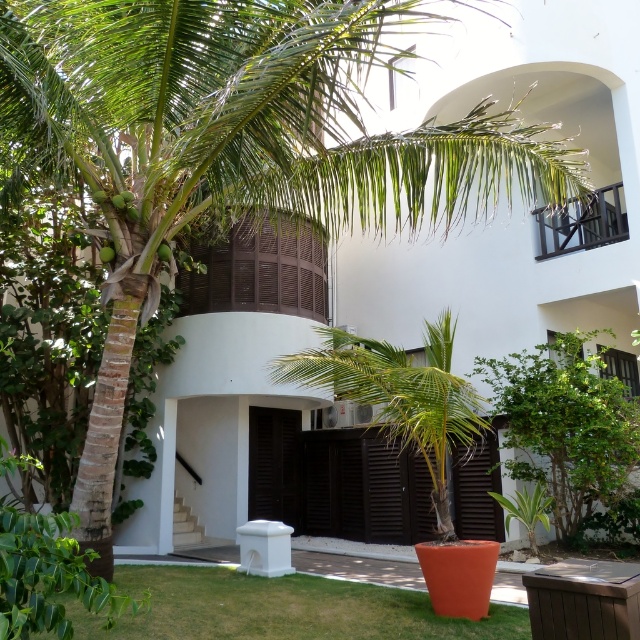
Is green grass at lower left positioned before green leafy palm tree at center?

That is True.

Is green grass at lower left shorter than green leafy palm tree at center?

Indeed, green grass at lower left has a lesser height compared to green leafy palm tree at center.

What do you see at coordinates (280, 609) in the screenshot?
I see `green grass at lower left` at bounding box center [280, 609].

This screenshot has height=640, width=640. In order to click on green grass at lower left in this screenshot , I will do `click(280, 609)`.